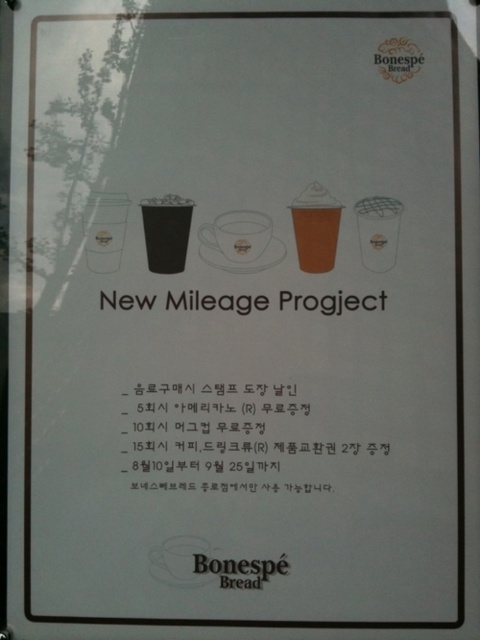
Who is more distant from viewer, (140, 404) or (319, 212)?

Positioned behind is point (140, 404).

This screenshot has height=640, width=480. Find the location of `black paper text at center`. black paper text at center is located at coordinates (222, 428).

Does black paper at center appear on the left side of brown paper cup at center?

Yes, black paper at center is to the left of brown paper cup at center.

Is point (345, 301) positioned after point (322, 224)?

That is False.

You are a GUI agent. You are given a task and a screenshot of the screen. Output one action in this format:
    pyautogui.click(x=<x>, y=<y>)
    Task: Click on the black paper at center
    Image resolution: width=480 pixels, height=640 pixels.
    Given the screenshot: What is the action you would take?
    pyautogui.click(x=333, y=301)

Who is more forward, (187, 301) or (175, 220)?

Point (175, 220) is in front.

This screenshot has height=640, width=480. What are the coordinates of `black paper at center` in the screenshot? It's located at (333, 301).

Identify the location of black paper at center. The width and height of the screenshot is (480, 640). (333, 301).